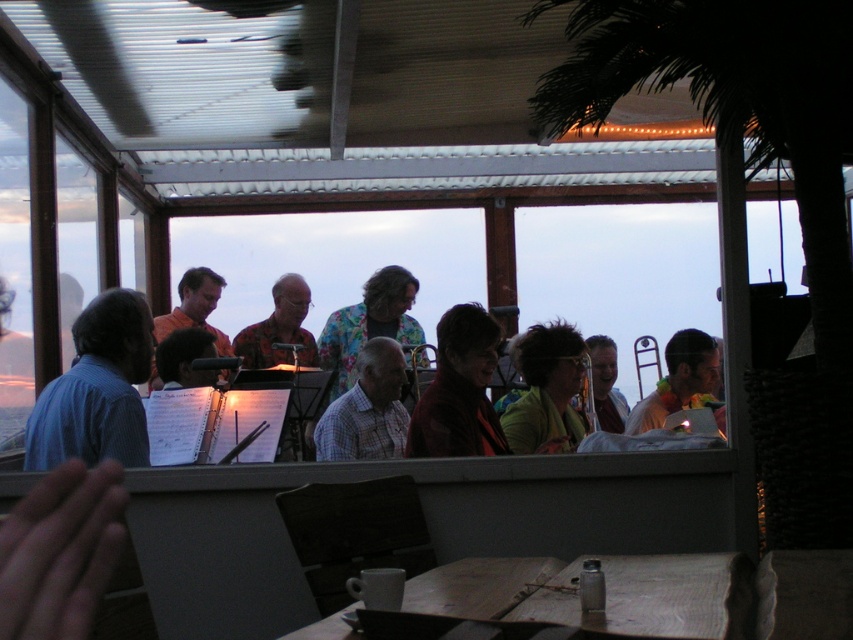
Question: Which of the following is the closest to the observer?

Choices:
 (A) (259, 342)
 (B) (518, 412)

Answer: (B)

Question: Which point is farther from the camera taking this photo?

Choices:
 (A) (300, 336)
 (B) (706, 371)
 (C) (155, 371)

Answer: (A)

Question: Can you confirm if checkered fabric shirt at center is positioned below matte black tie at center?

Choices:
 (A) yes
 (B) no

Answer: (A)

Question: Is wooden table at center to the right of matte red jacket at center from the viewer's perspective?

Choices:
 (A) no
 (B) yes

Answer: (B)

Question: Is matte red jacket at center smaller than checkered fabric shirt at center?

Choices:
 (A) no
 (B) yes

Answer: (A)

Question: Which point is farther to the camera?

Choices:
 (A) green matte jacket at center
 (B) hawaiian shirt at center

Answer: (B)